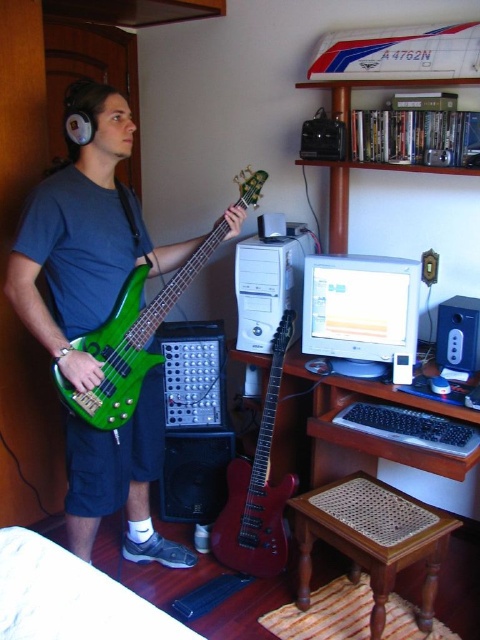
You are a music producer visiting the studio and need to sit down to review the recording. Where exactly is the brown woven stool at lower center located in the studio?

The brown woven stool at lower center is located at point [372,540] in the studio.

You are a visitor in the room and want to sit on the brown woven stool at lower center. Where should you go relative to the matte white monitor at center?

The brown woven stool at lower center is positioned on the right side of matte white monitor at center, so you should go to the right side of the matte white monitor at center to sit on the brown woven stool at lower center.